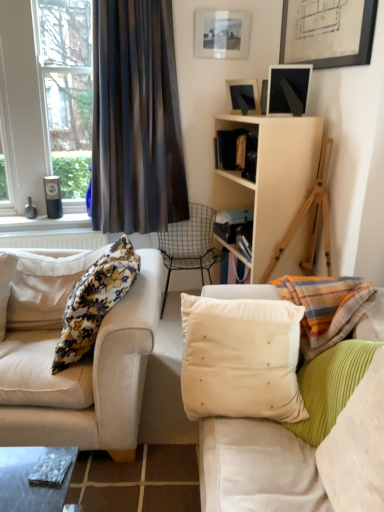
Locate an element on the screen. This screenshot has height=512, width=384. empty space that is ontop of matte black speaker at left (from a real-world perspective) is located at coordinates (44, 219).